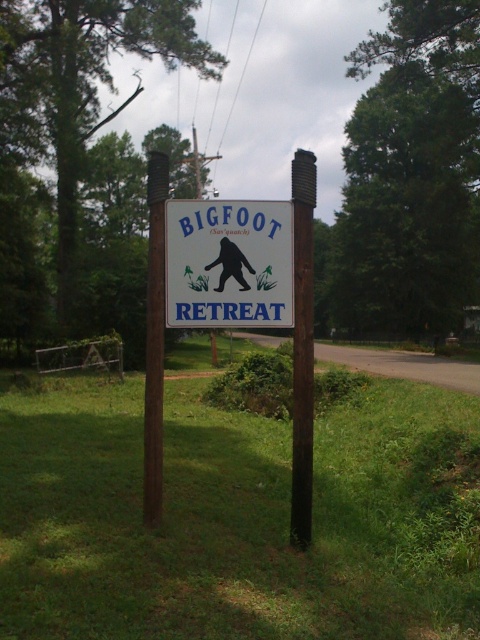
You are standing in front of the signboard and want to know how far the point at coordinates point (267, 204) is from you. Can you determine the distance?

The point (267, 204) is 5.83 meters from camera, so the distance from you to the point is approximately 5.83 meters.

Consider the image. You are a park ranger inspecting the signboard. You notice two brown posts holding up the signboard. One is labeled as brown wood post at center and the other as brown wooden post at center. Which post is smaller in size?

The brown wood post at center is smaller in size compared to the brown wooden post at center.